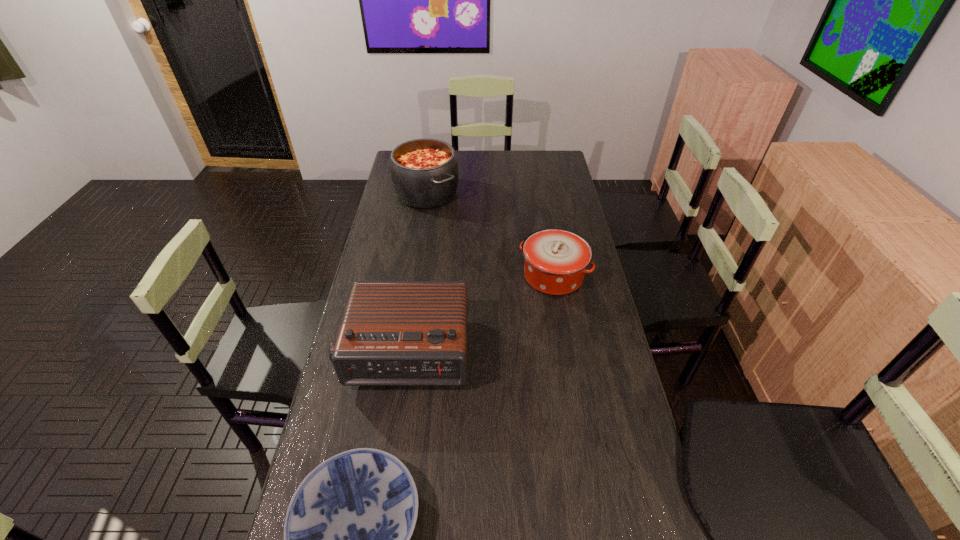
The image size is (960, 540). Find the location of `radio receiver situated at the left edge`. radio receiver situated at the left edge is located at coordinates (394, 333).

Identify the location of object positioned at the right edge. Image resolution: width=960 pixels, height=540 pixels. (556, 259).

Locate an element on the screen. The width and height of the screenshot is (960, 540). object positioned at the far left corner is located at coordinates (424, 172).

The image size is (960, 540). In the image, there is a desktop. In order to click on free space at the far edge in this screenshot , I will do `click(487, 153)`.

Locate an element on the screen. This screenshot has width=960, height=540. vacant area at the left edge of the desktop is located at coordinates (409, 238).

Where is `free space at the right edge`? free space at the right edge is located at coordinates (565, 358).

Where is `free space between the third nearest object and the third farthest object`? Image resolution: width=960 pixels, height=540 pixels. free space between the third nearest object and the third farthest object is located at coordinates (480, 314).

You are a GUI agent. You are given a task and a screenshot of the screen. Output one action in this format:
    pyautogui.click(x=<x>, y=<y>)
    Task: Click on the free spot between the farther casserole and the second nearest object
    
    Given the screenshot: What is the action you would take?
    pyautogui.click(x=417, y=273)

Where is `vacant region between the farther casserole and the rightmost object`? The image size is (960, 540). vacant region between the farther casserole and the rightmost object is located at coordinates (490, 235).

Where is `free point between the third farthest object and the right casserole`? This screenshot has width=960, height=540. free point between the third farthest object and the right casserole is located at coordinates (480, 314).